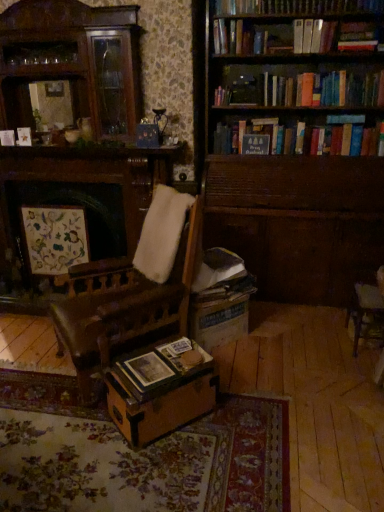
Question: Is hardcover book at upper right, the third book when ordered from bottom to top, turned away from wooden chair at right?

Choices:
 (A) yes
 (B) no

Answer: (B)

Question: Is hardcover book at upper right, which appears as the second book when viewed from the back, closer to the viewer compared to wooden chair at right?

Choices:
 (A) no
 (B) yes

Answer: (A)

Question: Does hardcover book at upper right, the third book positioned from the left, have a larger size compared to wooden chair at right?

Choices:
 (A) yes
 (B) no

Answer: (B)

Question: Is hardcover book at upper right, the third book when ordered from bottom to top, thinner than wooden chair at right?

Choices:
 (A) yes
 (B) no

Answer: (A)

Question: Is hardcover book at upper right, marked as the 1th book in a top-to-bottom arrangement, located outside wooden chair at right?

Choices:
 (A) no
 (B) yes

Answer: (B)

Question: Does hardcover book at upper right, which is counted as the second book, starting from the front, lie behind wooden trunk at center?

Choices:
 (A) no
 (B) yes

Answer: (B)

Question: Is hardcover book at upper right, the third book when ordered from bottom to top, in contact with wooden trunk at center?

Choices:
 (A) yes
 (B) no

Answer: (B)

Question: Does hardcover book at upper right, which appears as the second book when viewed from the back, have a greater height compared to wooden trunk at center?

Choices:
 (A) no
 (B) yes

Answer: (A)

Question: Does hardcover book at upper right, marked as the 1th book in a top-to-bottom arrangement, have a smaller size compared to wooden trunk at center?

Choices:
 (A) yes
 (B) no

Answer: (A)

Question: Can you confirm if hardcover book at upper right, marked as the 1th book in a top-to-bottom arrangement, is wider than wooden trunk at center?

Choices:
 (A) no
 (B) yes

Answer: (A)

Question: Does hardcover book at upper right, which is counted as the second book, starting from the front, turn towards wooden trunk at center?

Choices:
 (A) no
 (B) yes

Answer: (A)

Question: Is hardcover book at upper right, marked as the 1th book in a top-to-bottom arrangement, wider than wooden bookshelf at upper right?

Choices:
 (A) yes
 (B) no

Answer: (B)